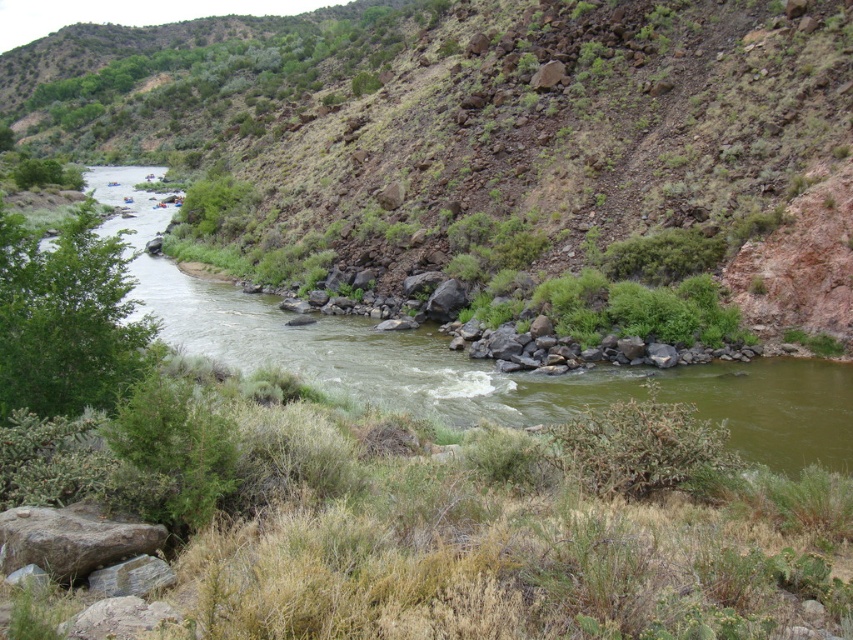
Is green grassy hillside at upper left bigger than green water at left?

Yes, green grassy hillside at upper left is bigger than green water at left.

Which is more to the right, green grassy hillside at upper left or green water at left?

green water at left is more to the right.

Image resolution: width=853 pixels, height=640 pixels. I want to click on green grassy hillside at upper left, so click(492, 150).